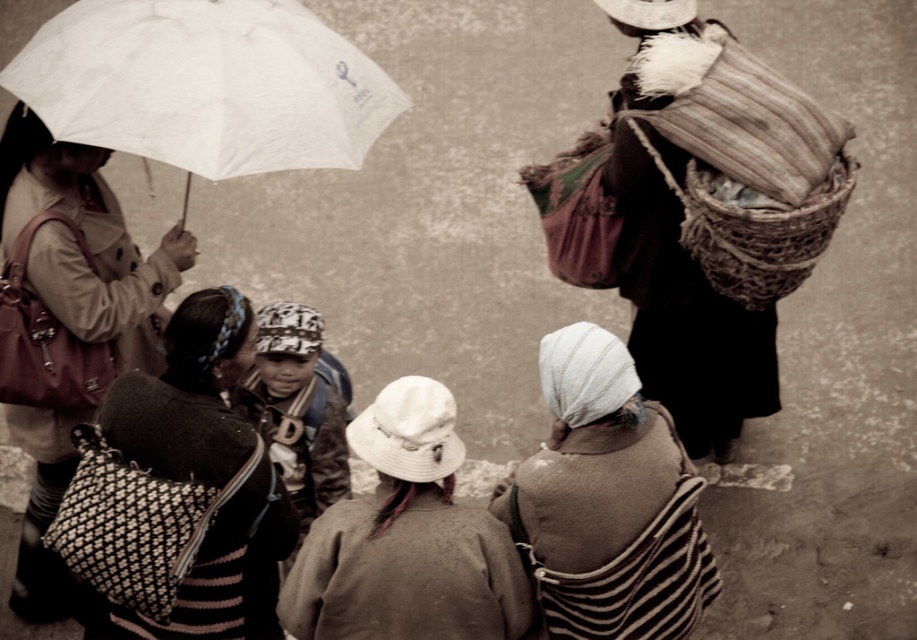
Question: Estimate the real-world distances between objects in this image. Which object is farther from the white matte umbrella at upper left?

Choices:
 (A) white striped shawl at center
 (B) white fabric hat at center
 (C) patterned fabric bag at left

Answer: (A)

Question: Which point appears closest to the camera in this image?

Choices:
 (A) (418, 376)
 (B) (373, 129)

Answer: (A)

Question: Is white matte umbrella at upper left positioned before white striped shawl at center?

Choices:
 (A) yes
 (B) no

Answer: (B)

Question: Which point appears closest to the camera in this image?

Choices:
 (A) (283, 131)
 (B) (504, 497)

Answer: (B)

Question: Is white striped shawl at center further to the viewer compared to white fabric hat at center?

Choices:
 (A) yes
 (B) no

Answer: (A)

Question: Where is patterned fabric bag at left located in relation to white fabric hat at center in the image?

Choices:
 (A) above
 (B) below

Answer: (A)